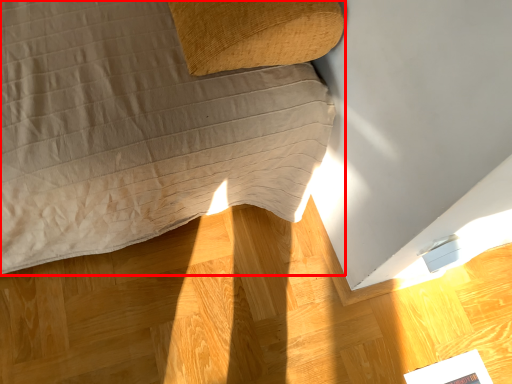
Question: From the image's perspective, where is furniture (annotated by the red box) located relative to magazine?

Choices:
 (A) above
 (B) below

Answer: (A)